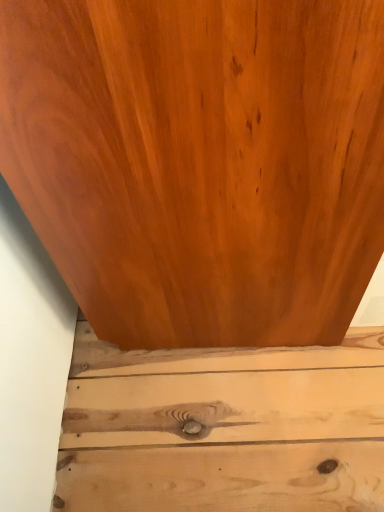
Find the location of a particular element. The width and height of the screenshot is (384, 512). glossy wood door at center is located at coordinates (200, 162).

What do you see at coordinates (200, 162) in the screenshot? Image resolution: width=384 pixels, height=512 pixels. I see `glossy wood door at center` at bounding box center [200, 162].

What is the approximate width of glossy wood door at center?

It is 18.77 inches.

The height and width of the screenshot is (512, 384). Find the location of `glossy wood door at center`. glossy wood door at center is located at coordinates (200, 162).